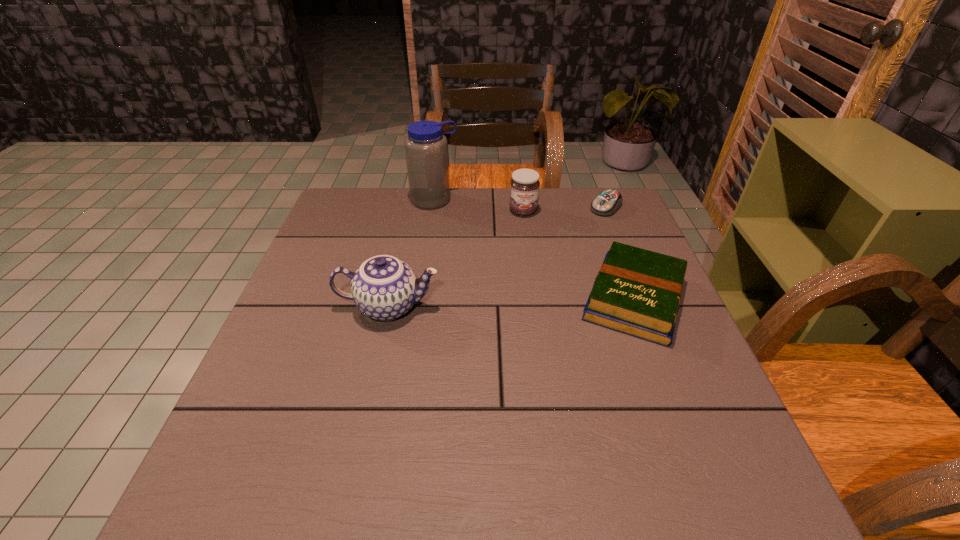
You are a GUI agent. You are given a task and a screenshot of the screen. Output one action in this format:
    pyautogui.click(x=<x>, y=<y>)
    Task: Click on the chinaware
    Image resolution: width=960 pixels, height=540 pixels.
    Given the screenshot: What is the action you would take?
    pyautogui.click(x=384, y=288)

Where is `book`? Image resolution: width=960 pixels, height=540 pixels. book is located at coordinates (638, 292).

Find the location of `the tallest object`. the tallest object is located at coordinates (426, 147).

Locate an element on the screen. The height and width of the screenshot is (540, 960). the third object from left to right is located at coordinates (524, 186).

Find the location of a particular element. the third tallest object is located at coordinates (524, 186).

The image size is (960, 540). I want to click on computer mouse, so (607, 202).

Locate an element on the screen. The height and width of the screenshot is (540, 960). vacant space located 0.170m at the spout of the fourth shortest object is located at coordinates (515, 307).

At what (x,y) coordinates should I click in order to perform the action: click on free space located on the front of the second shortest object. Please return your answer as a coordinate pair (x, y). Looking at the image, I should click on (672, 397).

The height and width of the screenshot is (540, 960). Find the location of `free space located 0.070m with a carrying loop on the side of the tallest object`. free space located 0.070m with a carrying loop on the side of the tallest object is located at coordinates (445, 223).

Where is `free spot located 0.320m with a carrying loop on the side of the tallest object`? The width and height of the screenshot is (960, 540). free spot located 0.320m with a carrying loop on the side of the tallest object is located at coordinates (468, 278).